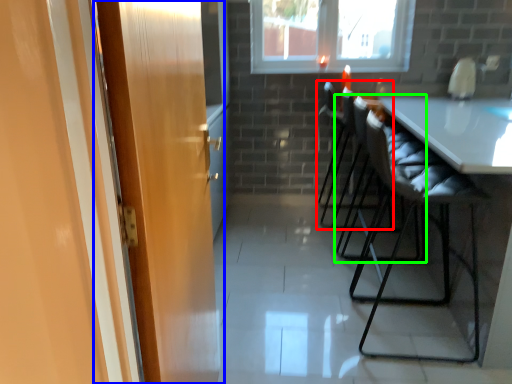
Question: Which object is the closest to the chair (highlighted by a red box)? Choose among these: door (highlighted by a blue box) or chair (highlighted by a green box).

Choices:
 (A) door
 (B) chair

Answer: (B)